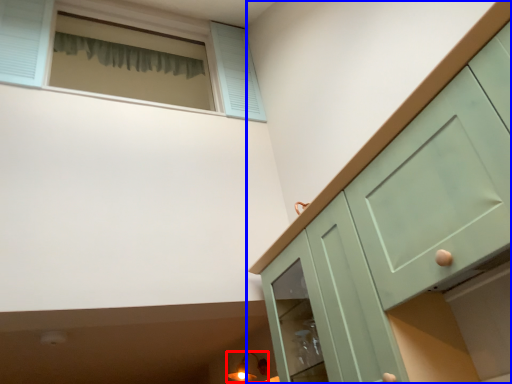
Question: Which object appears farthest to the camera in this image, light fixture (highlighted by a red box) or cabinetry (highlighted by a blue box)?

Choices:
 (A) light fixture
 (B) cabinetry

Answer: (A)